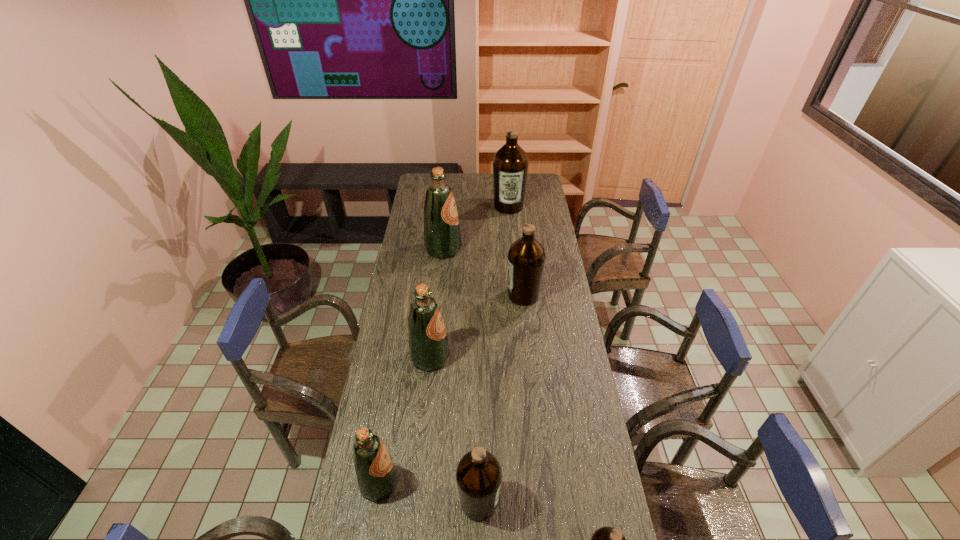
Find the location of `the closest object relative to the third farthest object`. the closest object relative to the third farthest object is located at coordinates (442, 239).

Locate which olive oil ranks third in proximity to the biggest brown olive oil. Please provide its 2D coordinates. Your answer should be formatted as a tuple, i.e. [(x, y)], where the tuple contains the x and y coordinates of a point satisfying the conditions above.

[(428, 346)]

Choose which olive oil is the fourth nearest neighbor to the second farthest object. Please provide its 2D coordinates. Your answer should be formatted as a tuple, i.e. [(x, y)], where the tuple contains the x and y coordinates of a point satisfying the conditions above.

[(375, 470)]

The height and width of the screenshot is (540, 960). I want to click on green olive oil that is the third closest to the shortest object, so click(442, 239).

Where is `the closest green olive oil to the second farthest olive oil`? The image size is (960, 540). the closest green olive oil to the second farthest olive oil is located at coordinates (428, 346).

Where is `brown olive oil that stands as the third closest to the smallest green olive oil`? brown olive oil that stands as the third closest to the smallest green olive oil is located at coordinates (526, 257).

You are a GUI agent. You are given a task and a screenshot of the screen. Output one action in this format:
    pyautogui.click(x=<x>, y=<y>)
    Task: Click on the brown olive oil that is the third closest to the nearest green olive oil
    Image resolution: width=960 pixels, height=540 pixels.
    Given the screenshot: What is the action you would take?
    pyautogui.click(x=526, y=257)